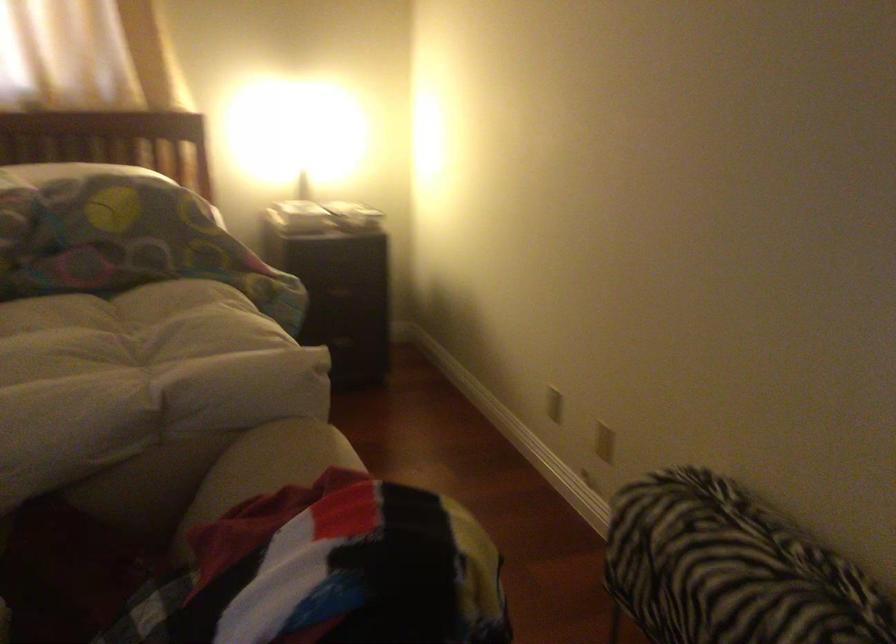
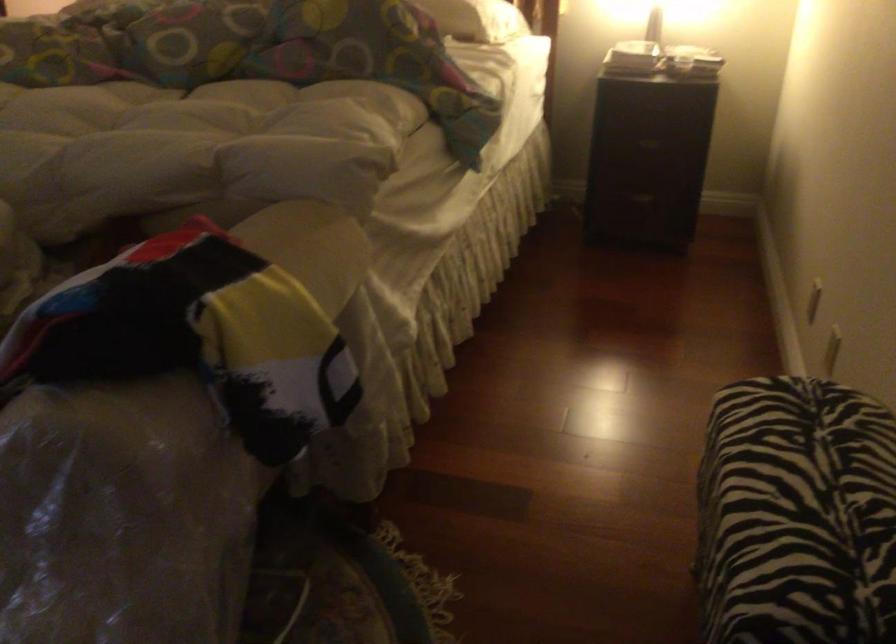
Locate, in the second image, the point that corresponds to (x=340, y=292) in the first image.

(650, 140)